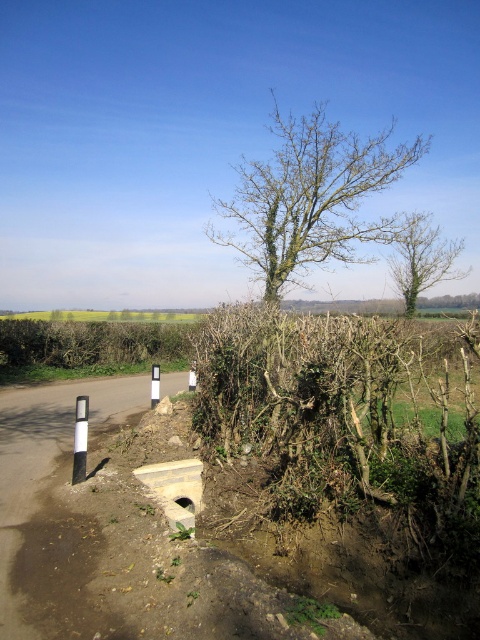
Does brown dry hedge at center have a lesser width compared to white plastic pole at left?

Incorrect, brown dry hedge at center's width is not less than white plastic pole at left's.

Consider the image. Can you confirm if brown dry hedge at center is taller than white plastic pole at left?

Yes.

Where is `brown dry hedge at center`? This screenshot has width=480, height=640. brown dry hedge at center is located at coordinates (336, 410).

Is bare branches at upper center smaller than white plastic pole at left?

Yes, bare branches at upper center is smaller than white plastic pole at left.

Does bare branches at upper center appear on the right side of white plastic pole at left?

Correct, you'll find bare branches at upper center to the right of white plastic pole at left.

Where is `bare branches at upper center`? The image size is (480, 640). bare branches at upper center is located at coordinates (420, 259).

Which is above, bare branches at center or bare branches at upper center?

bare branches at center

Which is in front, point (377, 173) or point (419, 237)?

Positioned in front is point (377, 173).

Where is `bare branches at center`? bare branches at center is located at coordinates (311, 198).